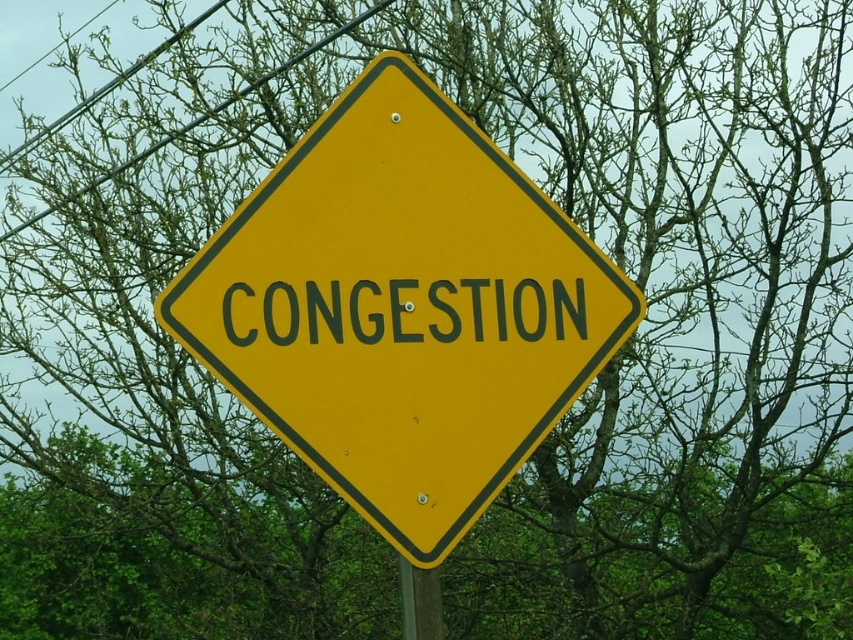
Question: Considering the real-world distances, which object is farthest from the green wood pole at lower center?

Choices:
 (A) yellow matte/concrete sign at center
 (B) metallic wire at upper left

Answer: (B)

Question: Which of the following is the closest to the observer?

Choices:
 (A) (115, 168)
 (B) (347, 497)

Answer: (B)

Question: Can you confirm if metallic wire at upper left is wider than green wood pole at lower center?

Choices:
 (A) no
 (B) yes

Answer: (B)

Question: Can you confirm if metallic wire at upper left is positioned above green wood pole at lower center?

Choices:
 (A) yes
 (B) no

Answer: (A)

Question: Which of the following is the closest to the observer?

Choices:
 (A) (372, 424)
 (B) (436, 593)
 (C) (165, 138)

Answer: (A)

Question: Is yellow matte/concrete sign at center to the left of metallic wire at upper left from the viewer's perspective?

Choices:
 (A) no
 (B) yes

Answer: (A)